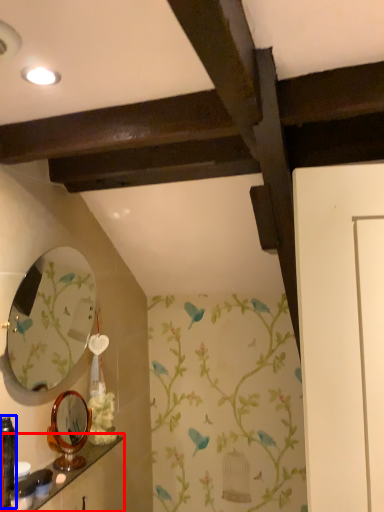
Question: Which of the following is the farthest to the observer, shelf (highlighted by a red box) or toiletry (highlighted by a blue box)?

Choices:
 (A) shelf
 (B) toiletry

Answer: (A)